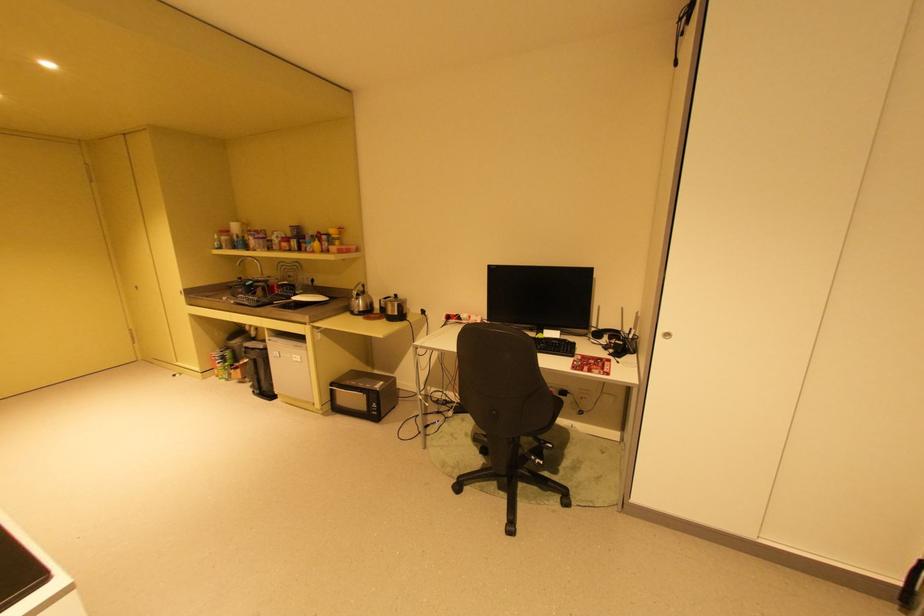
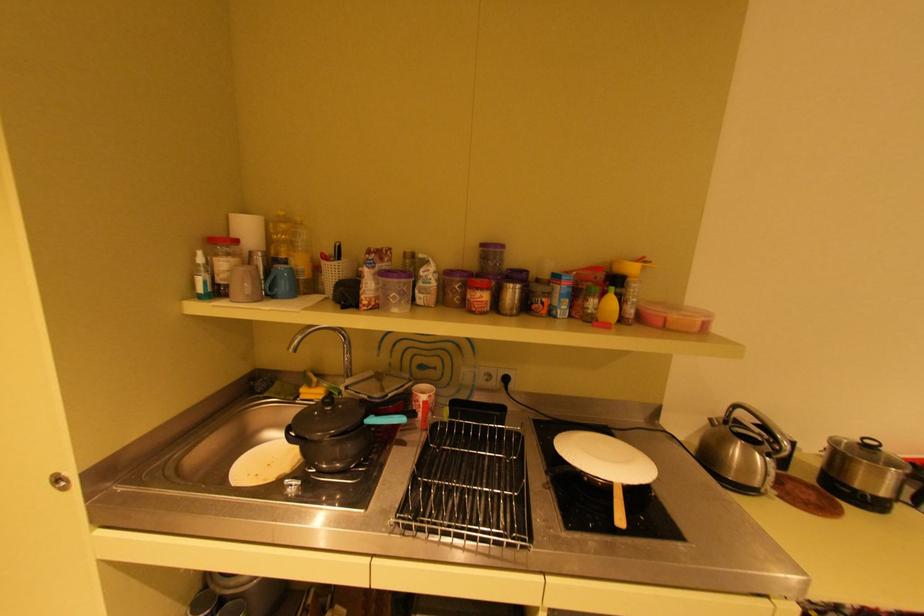
The point at (225, 249) is marked in the first image. Where is the corresponding point in the second image?

(208, 297)